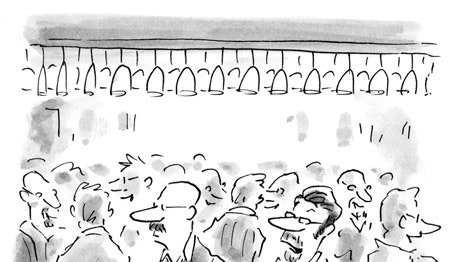
Where is `glass`? The width and height of the screenshot is (465, 262). glass is located at coordinates (307, 222).